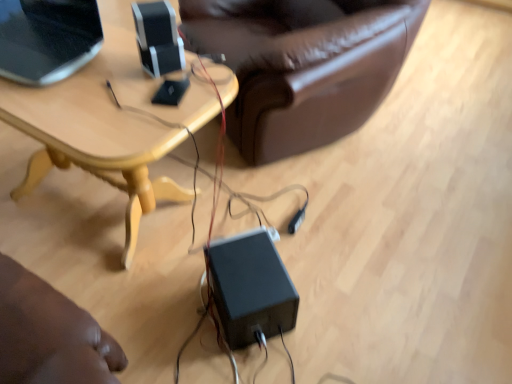
Question: In terms of size, does black matte speaker at upper center, which ranks as the 2th speaker in right-to-left order, appear bigger or smaller than matte black laptop at upper left?

Choices:
 (A) small
 (B) big

Answer: (A)

Question: Looking at their shapes, would you say black matte speaker at upper center, which is the 2th speaker from bottom to top, is wider or thinner than matte black laptop at upper left?

Choices:
 (A) thin
 (B) wide

Answer: (A)

Question: Which object is the closest to the light wood table at center?

Choices:
 (A) black plastic power supply at center, the second speaker viewed from the left
 (B) black matte speaker at upper center, which ranks as the 2th speaker in right-to-left order
 (C) matte black laptop at upper left

Answer: (C)

Question: Estimate the real-world distances between objects in this image. Which object is closer to the black matte speaker at upper center, which is the 2th speaker from bottom to top?

Choices:
 (A) light wood table at center
 (B) black plastic power supply at center, the second speaker viewed from the left
 (C) matte black laptop at upper left

Answer: (A)